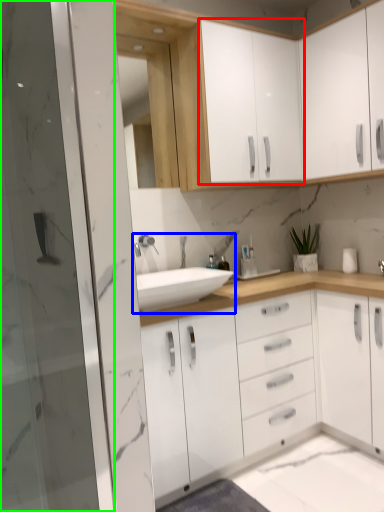
Question: Considering the real-world distances, which object is closest to cabinetry (highlighted by a red box)? sink (highlighted by a blue box) or screen door (highlighted by a green box).

Choices:
 (A) sink
 (B) screen door

Answer: (A)